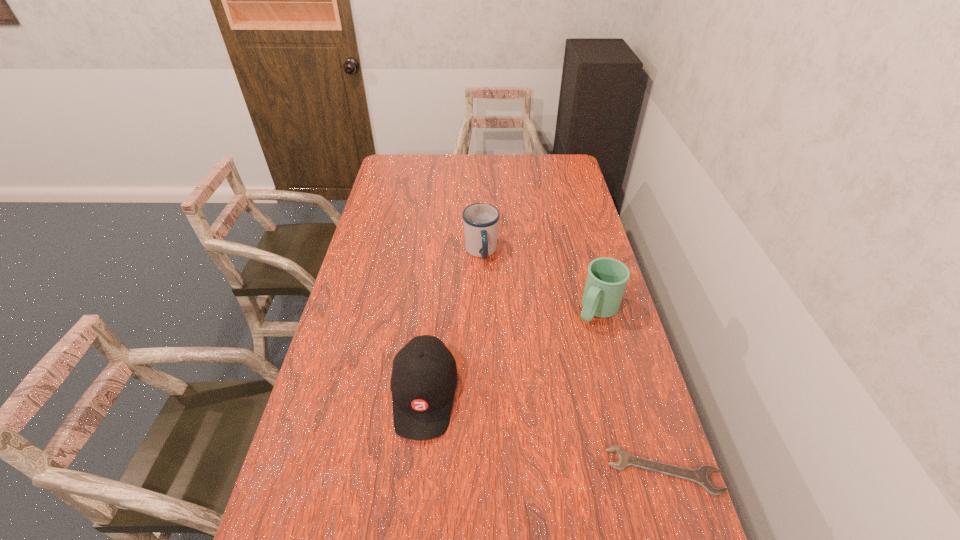
Locate an element on the screen. The width and height of the screenshot is (960, 540). free point at the far left corner is located at coordinates (403, 179).

Image resolution: width=960 pixels, height=540 pixels. Identify the location of vacant space at the far right corner of the desktop. (555, 173).

The image size is (960, 540). In order to click on free space between the nearest object and the right mug in this screenshot , I will do `click(631, 390)`.

The image size is (960, 540). Identify the location of vacant space that's between the baseball cap and the right mug. (511, 353).

Where is `vacant area between the third farthest object and the nearer mug`? This screenshot has height=540, width=960. vacant area between the third farthest object and the nearer mug is located at coordinates (511, 353).

At what (x,y) coordinates should I click in order to perform the action: click on free space between the nearer mug and the baseball cap. Please return your answer as a coordinate pair (x, y). Looking at the image, I should click on (511, 353).

Identify the location of vacant space that's between the wrench and the baseball cap. The image size is (960, 540). (544, 433).

This screenshot has height=540, width=960. In order to click on vacant area between the second farthest object and the left mug in this screenshot , I will do `click(540, 281)`.

Identify the location of free spot between the second nearest object and the farther mug. (453, 323).

Find the location of a particular element. The height and width of the screenshot is (540, 960). empty space between the shortest object and the nearer mug is located at coordinates (631, 390).